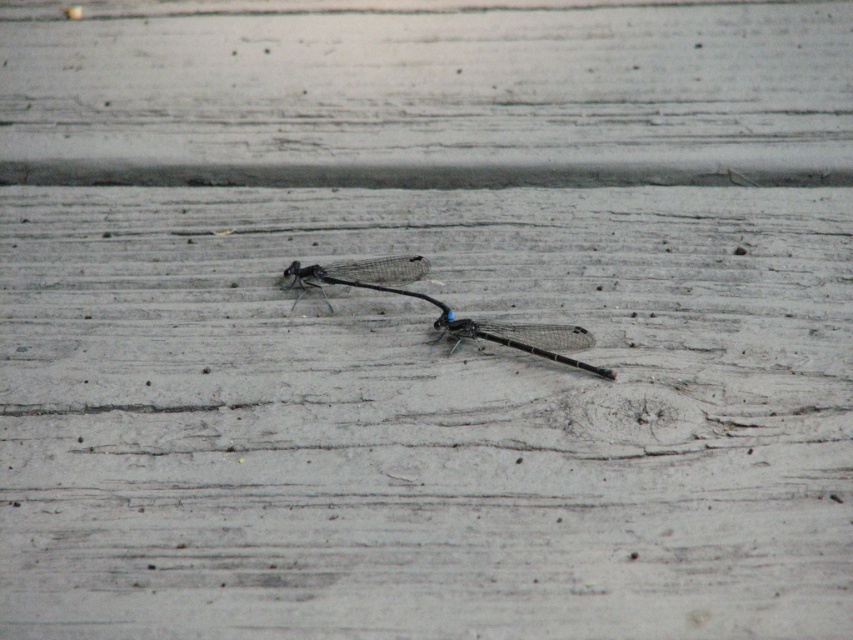
Between matte black dragonfly at center and transparent glass dragonfly at center, which one appears on the right side from the viewer's perspective?

matte black dragonfly at center is more to the right.

Which of these two, matte black dragonfly at center or transparent glass dragonfly at center, stands shorter?

Standing shorter between the two is transparent glass dragonfly at center.

Where is `matte black dragonfly at center`? The image size is (853, 640). matte black dragonfly at center is located at coordinates (502, 330).